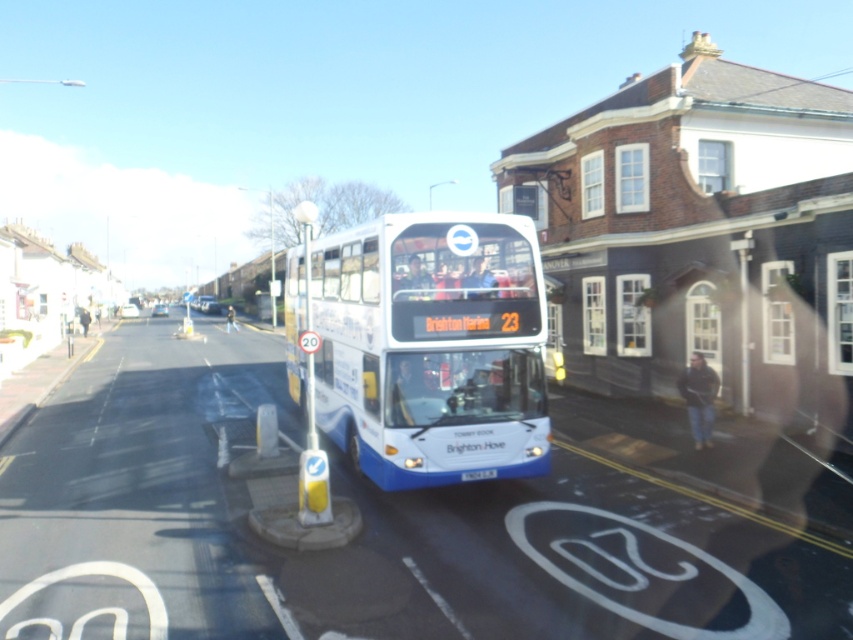
Which is more to the right, white glossy bus at center or white plastic license plate at center?

white plastic license plate at center

Does white glossy bus at center have a lesser width compared to white plastic license plate at center?

In fact, white glossy bus at center might be wider than white plastic license plate at center.

The height and width of the screenshot is (640, 853). Describe the element at coordinates (426, 346) in the screenshot. I see `white glossy bus at center` at that location.

Where is `white glossy bus at center`? white glossy bus at center is located at coordinates (426, 346).